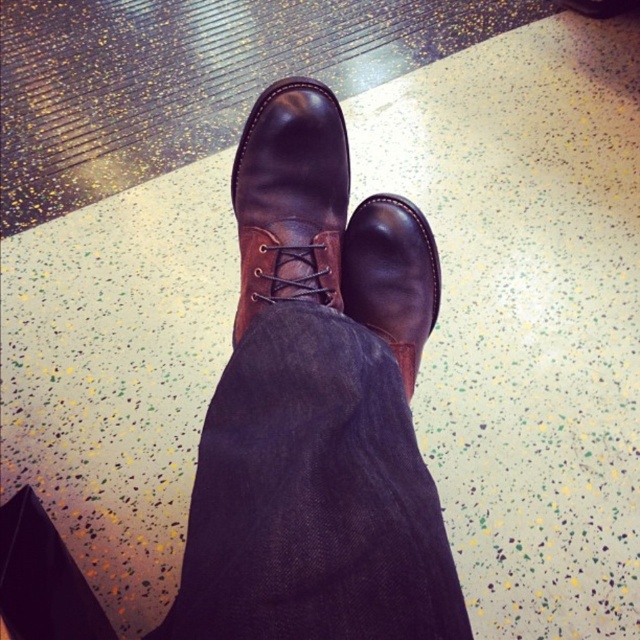
Question: Can you confirm if dark blue denim jeans at center is bigger than brown leather boot at center?

Choices:
 (A) yes
 (B) no

Answer: (A)

Question: Is shiny brown leather boot at center in front of brown leather boot at center?

Choices:
 (A) no
 (B) yes

Answer: (B)

Question: Which object is the farthest from the shiny brown leather boot at center?

Choices:
 (A) dark blue denim jeans at center
 (B) brown leather boot at center

Answer: (A)

Question: Is dark blue denim jeans at center below brown leather boot at center?

Choices:
 (A) yes
 (B) no

Answer: (A)

Question: Estimate the real-world distances between objects in this image. Which object is farther from the brown leather boot at center?

Choices:
 (A) dark blue denim jeans at center
 (B) shiny brown leather boot at center

Answer: (A)

Question: Which is farther from the shiny brown leather boot at center?

Choices:
 (A) dark blue denim jeans at center
 (B) brown leather boot at center

Answer: (A)